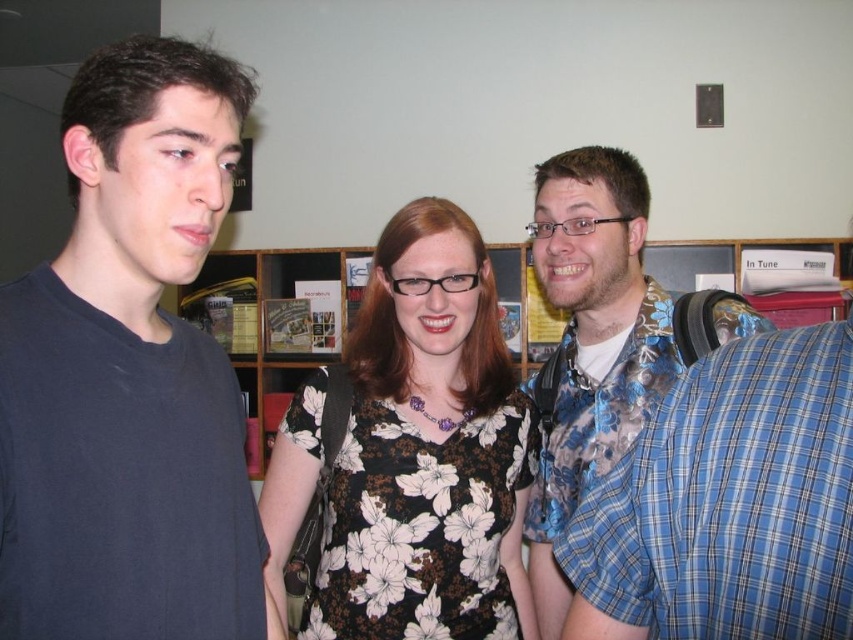
You are a photographer setting up for a group photo. You need to position yourself so that both the floral fabric dress at center and the floral shirt at right are in focus. Which object should you focus on first to ensure both are sharp?

You should focus on the floral fabric dress at center first since it is closer to the viewer than the floral shirt at right. By focusing on the closer object, the farther one will also be in focus due to the depth of field.

You are a delivery robot with a width of 1 meter. You need to move from your current position to the wooden bookshelf at center while avoiding the floral shirt at right. Can you safely navigate the space between them without colliding?

The distance between the floral shirt at right and the wooden bookshelf at center is 1.62 meters. Since the robot is 1 meter wide, there is sufficient space to navigate safely between them as the distance is greater than the robot width.